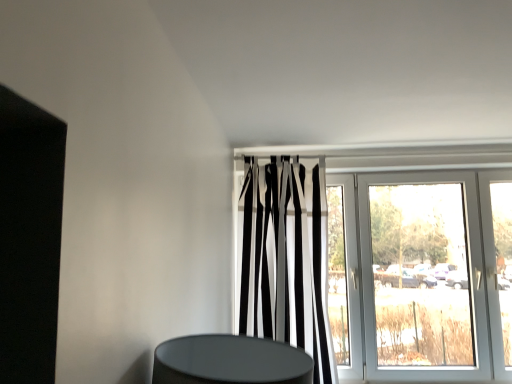
Question: Based on their sizes in the image, would you say black and white striped curtain at center is bigger or smaller than white glossy door at upper center?

Choices:
 (A) big
 (B) small

Answer: (B)

Question: Would you say black and white striped curtain at center is inside or outside white glossy door at upper center?

Choices:
 (A) inside
 (B) outside

Answer: (B)

Question: Is black and white striped curtain at center taller or shorter than white glossy door at upper center?

Choices:
 (A) tall
 (B) short

Answer: (A)

Question: Is point (470, 370) closer or farther from the camera than point (320, 291)?

Choices:
 (A) closer
 (B) farther

Answer: (B)

Question: Is white glossy door at upper center taller or shorter than black and white striped curtain at center?

Choices:
 (A) short
 (B) tall

Answer: (A)

Question: Is white glossy door at upper center situated inside black and white striped curtain at center or outside?

Choices:
 (A) outside
 (B) inside

Answer: (A)

Question: From the image's perspective, is white glossy door at upper center above or below black and white striped curtain at center?

Choices:
 (A) below
 (B) above

Answer: (A)